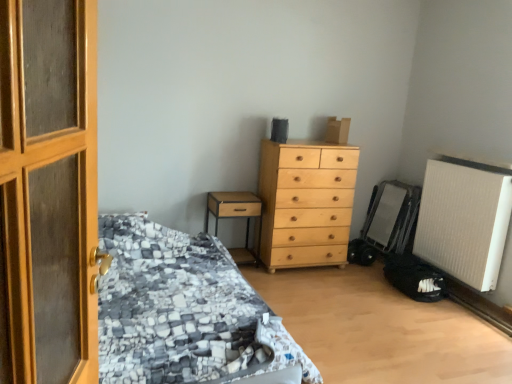
This screenshot has height=384, width=512. Identify the location of brown wood nightstand at left. (236, 217).

What are the coordinates of `textured gray fabric bed at left` in the screenshot? It's located at (183, 312).

Where is `white textured radiator at lower right`? white textured radiator at lower right is located at coordinates (464, 222).

Image resolution: width=512 pixels, height=384 pixels. What do you see at coordinates (464, 222) in the screenshot? I see `white textured radiator at lower right` at bounding box center [464, 222].

Describe the element at coordinates (306, 203) in the screenshot. I see `light wood chest of drawers at center` at that location.

Identify the location of brown wood nightstand at left. This screenshot has height=384, width=512. (236, 217).

From a real-world perspective, is white textured radiator at lower right physically below light wood chest of drawers at center?

No.

Based on their positions, is white textured radiator at lower right located to the left or right of light wood chest of drawers at center?

From the image, it's evident that white textured radiator at lower right is to the right of light wood chest of drawers at center.

Is white textured radiator at lower right inside or outside of light wood chest of drawers at center?

white textured radiator at lower right is outside light wood chest of drawers at center.

Does white textured radiator at lower right lie behind brown wood nightstand at left?

No, white textured radiator at lower right is in front of brown wood nightstand at left.

From a real-world perspective, is white textured radiator at lower right located beneath brown wood nightstand at left?

No, from a real-world perspective, white textured radiator at lower right is not beneath brown wood nightstand at left.

Is point (489, 197) less distant than point (247, 260)?

Yes, point (489, 197) is in front of point (247, 260).

Which object is further away from the camera, light wood chest of drawers at center or brown wood nightstand at left?

brown wood nightstand at left is more distant.

How different are the orientations of light wood chest of drawers at center and brown wood nightstand at left in degrees?

There is a 0.00106-degree angle between the facing directions of light wood chest of drawers at center and brown wood nightstand at left.

Consider the image. Based on their sizes in the image, would you say light wood chest of drawers at center is bigger or smaller than brown wood nightstand at left?

In the image, light wood chest of drawers at center appears to be larger than brown wood nightstand at left.

From the image's perspective, which one is positioned lower, light wood chest of drawers at center or brown wood nightstand at left?

brown wood nightstand at left is shown below in the image.

Is the position of light wood chest of drawers at center more distant than that of white textured radiator at lower right?

Yes, it is.

Which is more to the right, light wood chest of drawers at center or white textured radiator at lower right?

From the viewer's perspective, white textured radiator at lower right appears more on the right side.

Are brown wood nightstand at left and textured gray fabric bed at left far apart?

No, brown wood nightstand at left is not far away from textured gray fabric bed at left.

Considering the positions of objects brown wood nightstand at left and textured gray fabric bed at left in the image provided, who is behind, brown wood nightstand at left or textured gray fabric bed at left?

brown wood nightstand at left.

From a real-world perspective, who is located higher, brown wood nightstand at left or textured gray fabric bed at left?

From a 3D spatial view, brown wood nightstand at left is above.

Is brown wood nightstand at left facing away from textured gray fabric bed at left?

Yes, brown wood nightstand at left's orientation is away from textured gray fabric bed at left.

Is brown wood nightstand at left facing away from white textured radiator at lower right?

That's not correct — brown wood nightstand at left is not looking away from white textured radiator at lower right.

In the image, there is a brown wood nightstand at left. Where is `air conditioning above it (from the image's perspective)`? Image resolution: width=512 pixels, height=384 pixels. air conditioning above it (from the image's perspective) is located at coordinates (464, 222).

Considering the sizes of objects brown wood nightstand at left and white textured radiator at lower right in the image provided, who is wider, brown wood nightstand at left or white textured radiator at lower right?

brown wood nightstand at left is wider.

Is the surface of white textured radiator at lower right in direct contact with textured gray fabric bed at left?

They are not placed beside each other.

Which of these two, white textured radiator at lower right or textured gray fabric bed at left, stands shorter?

Standing shorter between the two is textured gray fabric bed at left.

Identify the location of air conditioning to the right of light wood chest of drawers at center. (464, 222).

This screenshot has height=384, width=512. Find the location of `air conditioning that appears in front of the brown wood nightstand at left`. air conditioning that appears in front of the brown wood nightstand at left is located at coordinates (464, 222).

Which object lies nearer to the anchor point brown wood nightstand at left, textured gray fabric bed at left or white textured radiator at lower right?

textured gray fabric bed at left is positioned closer to the anchor brown wood nightstand at left.

From the image, which object appears to be farther from textured gray fabric bed at left, white textured radiator at lower right or brown wood nightstand at left?

The object further to textured gray fabric bed at left is white textured radiator at lower right.

Considering their positions, is white textured radiator at lower right positioned closer to light wood chest of drawers at center than brown wood nightstand at left?

The object closer to light wood chest of drawers at center is brown wood nightstand at left.

From the image, which object appears to be farther from white textured radiator at lower right, light wood chest of drawers at center or brown wood nightstand at left?

Among the two, brown wood nightstand at left is located further to white textured radiator at lower right.

Estimate the real-world distances between objects in this image. Which object is closer to white textured radiator at lower right, brown wood nightstand at left or light wood chest of drawers at center?

Based on the image, light wood chest of drawers at center appears to be nearer to white textured radiator at lower right.

Which object lies further to the anchor point brown wood nightstand at left, textured gray fabric bed at left or light wood chest of drawers at center?

textured gray fabric bed at left.

Based on their spatial positions, is textured gray fabric bed at left or white textured radiator at lower right closer to light wood chest of drawers at center?

white textured radiator at lower right is positioned closer to the anchor light wood chest of drawers at center.

In the scene shown: When comparing their distances from light wood chest of drawers at center, does textured gray fabric bed at left or brown wood nightstand at left seem closer?

brown wood nightstand at left lies closer to light wood chest of drawers at center than the other object.

Identify the location of nightstand between textured gray fabric bed at left and white textured radiator at lower right. (236, 217).

The width and height of the screenshot is (512, 384). I want to click on the chest of drawers situated between textured gray fabric bed at left and white textured radiator at lower right from left to right, so click(x=306, y=203).

Image resolution: width=512 pixels, height=384 pixels. In order to click on chest of drawers between textured gray fabric bed at left and brown wood nightstand at left in the front-back direction in this screenshot , I will do `click(306, 203)`.

You are a GUI agent. You are given a task and a screenshot of the screen. Output one action in this format:
    pyautogui.click(x=<x>, y=<y>)
    Task: Click on the chest of drawers between brown wood nightstand at left and white textured radiator at lower right in the horizontal direction
    
    Given the screenshot: What is the action you would take?
    pyautogui.click(x=306, y=203)